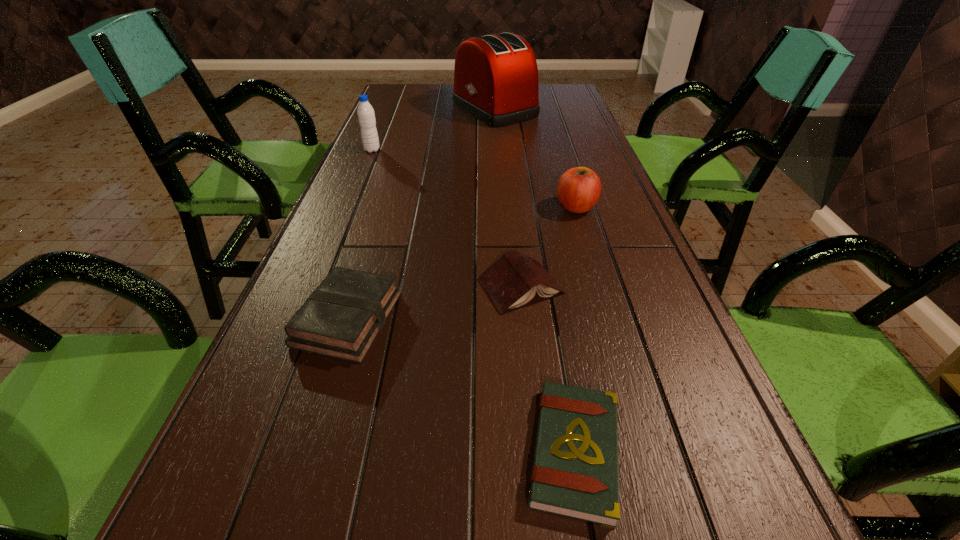
Identify the location of the farthest object. (496, 76).

Identify the location of the tallest object. (496, 76).

Find the location of a particular element. The width and height of the screenshot is (960, 540). water bottle is located at coordinates [x=366, y=116].

Find the location of a particular element. The height and width of the screenshot is (540, 960). the second tallest object is located at coordinates (366, 116).

This screenshot has height=540, width=960. What are the coordinates of `apple` in the screenshot? It's located at (578, 190).

You are a GUI agent. You are given a task and a screenshot of the screen. Output one action in this format:
    pyautogui.click(x=<x>, y=<y>)
    Task: Click on the fourth shortest object
    The height and width of the screenshot is (540, 960).
    Given the screenshot: What is the action you would take?
    pyautogui.click(x=578, y=190)

Where is `the leftmost book`? Image resolution: width=960 pixels, height=540 pixels. the leftmost book is located at coordinates (341, 319).

The height and width of the screenshot is (540, 960). What are the coordinates of `the nearest book` in the screenshot? It's located at (575, 473).

In order to click on the shortest object in this screenshot , I will do `click(575, 473)`.

Image resolution: width=960 pixels, height=540 pixels. What are the coordinates of `vacant space positioned on the left of the farthest object` in the screenshot? It's located at (419, 110).